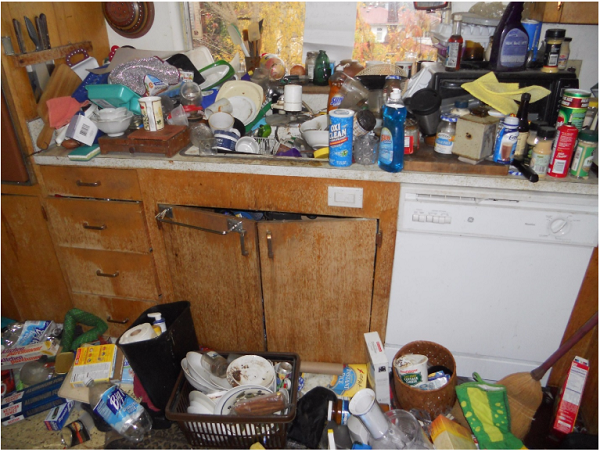
Locate an element on the screen. broom is located at coordinates (530, 393).